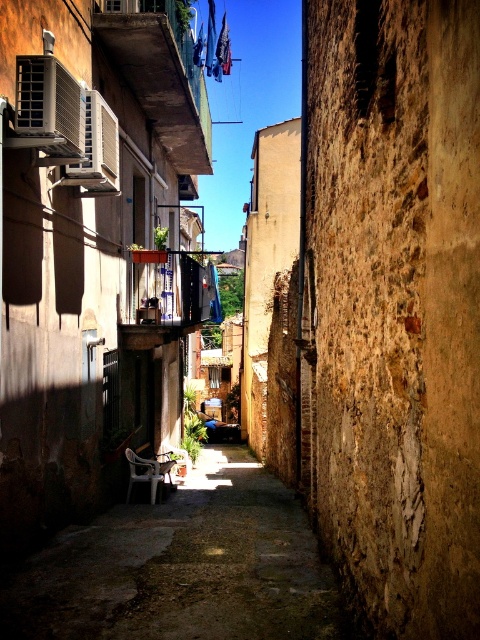
Question: Does rustic stone wall at center appear on the left side of smooth concrete alley at center?

Choices:
 (A) yes
 (B) no

Answer: (B)

Question: Does rustic stone wall at center have a greater width compared to smooth concrete alley at center?

Choices:
 (A) no
 (B) yes

Answer: (A)

Question: Which of the following is the closest to the observer?

Choices:
 (A) rustic stone wall at center
 (B) smooth concrete alley at center

Answer: (B)

Question: Can you confirm if rustic stone wall at center is positioned to the left of smooth concrete alley at center?

Choices:
 (A) yes
 (B) no

Answer: (B)